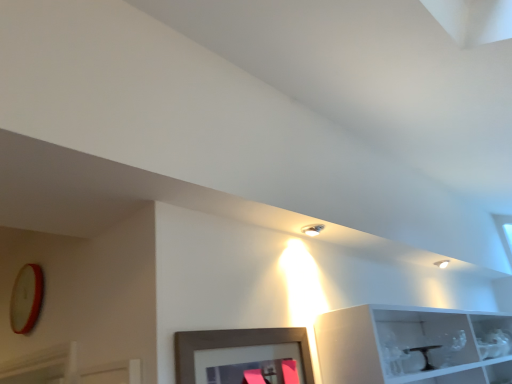
Describe the element at coordinates (234, 346) in the screenshot. The height and width of the screenshot is (384, 512). I see `matte black picture frame at center` at that location.

What is the approximate height of matte black picture frame at center?

matte black picture frame at center is 8.11 inches tall.

Where is `matte black picture frame at center`? The width and height of the screenshot is (512, 384). matte black picture frame at center is located at coordinates (234, 346).

Locate an element on the screen. matte black picture frame at center is located at coordinates (234, 346).